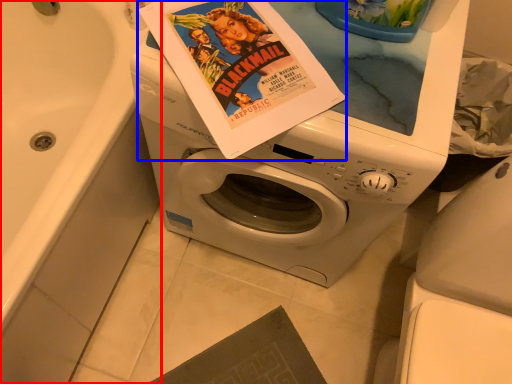
Question: Which object appears farthest to the camera in this image, bath (highlighted by a red box) or paperback book (highlighted by a blue box)?

Choices:
 (A) bath
 (B) paperback book

Answer: (B)